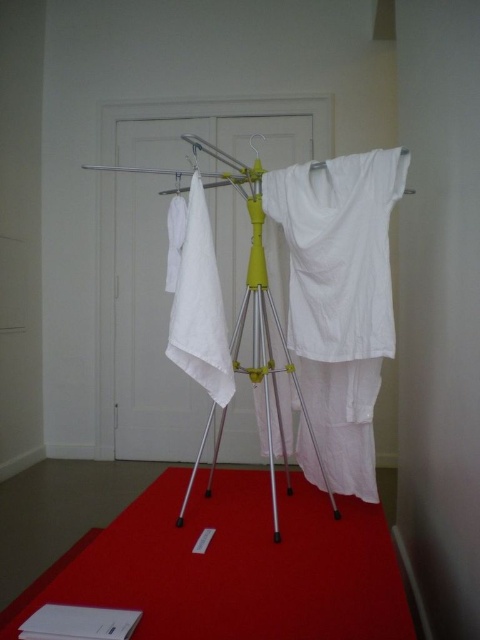
Question: Which of the following is the closest to the observer?

Choices:
 (A) (272, 310)
 (B) (374, 552)

Answer: (B)

Question: From the image, what is the correct spatial relationship of red carpet at lower center in relation to yellow metallic tripod at center?

Choices:
 (A) left
 (B) right

Answer: (B)

Question: Is red carpet at lower center above yellow metallic tripod at center?

Choices:
 (A) yes
 (B) no

Answer: (B)

Question: Among these objects, which one is farthest from the camera?

Choices:
 (A) yellow metallic tripod at center
 (B) red carpet at lower center

Answer: (A)

Question: Observing the image, what is the correct spatial positioning of red carpet at lower center in reference to yellow metallic tripod at center?

Choices:
 (A) above
 (B) below

Answer: (B)